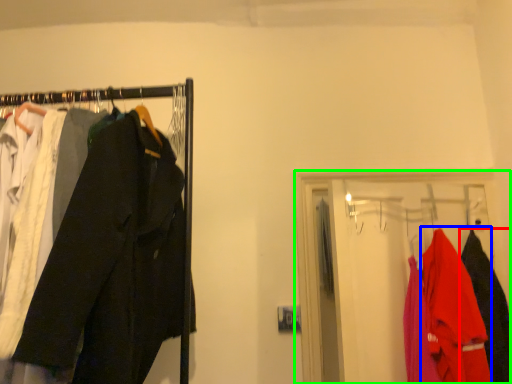
Question: Which object is the closest to the clothing (highlighted by a red box)? Choose among these: clothing (highlighted by a blue box) or closet (highlighted by a green box).

Choices:
 (A) clothing
 (B) closet

Answer: (A)